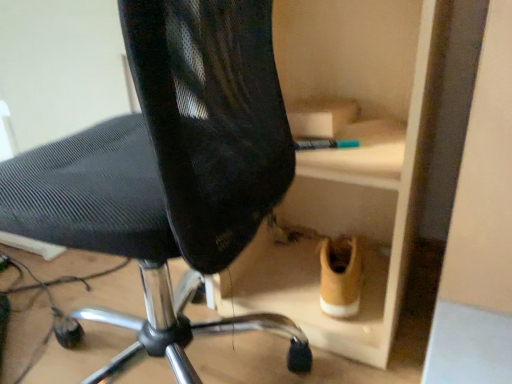
In order to face black mesh chair at center, should I rotate leftwards or rightwards?

You should look left and rotate roughly 17.516 degrees.

This screenshot has height=384, width=512. In order to click on black mesh chair at center in this screenshot , I will do `click(170, 169)`.

This screenshot has width=512, height=384. What do you see at coordinates (170, 169) in the screenshot?
I see `black mesh chair at center` at bounding box center [170, 169].

Looking at this image, measure the distance between black mesh chair at center and camera.

The distance of black mesh chair at center from camera is 14.57 inches.

The image size is (512, 384). I want to click on tan suede sneaker at lower right, so click(x=340, y=277).

Describe the element at coordinates (340, 277) in the screenshot. This screenshot has height=384, width=512. I see `tan suede sneaker at lower right` at that location.

You are a GUI agent. You are given a task and a screenshot of the screen. Output one action in this format:
    pyautogui.click(x=<x>, y=<y>)
    Task: Click on the black mesh chair at center
    Image resolution: width=512 pixels, height=384 pixels.
    Given the screenshot: What is the action you would take?
    pyautogui.click(x=170, y=169)

Based on their positions, is tan suede sneaker at lower right located to the left or right of black mesh chair at center?

In the image, tan suede sneaker at lower right appears on the right side of black mesh chair at center.

Between tan suede sneaker at lower right and black mesh chair at center, which one is positioned behind?

tan suede sneaker at lower right is further away from the camera.

Which is farther from the camera, (x=339, y=313) or (x=49, y=200)?

The point (x=339, y=313) is more distant.

From the image's perspective, is tan suede sneaker at lower right positioned above or below black mesh chair at center?

Based on their image positions, tan suede sneaker at lower right is located beneath black mesh chair at center.

From a real-world perspective, is tan suede sneaker at lower right positioned above or below black mesh chair at center?

tan suede sneaker at lower right is situated lower than black mesh chair at center in the real world.

Between tan suede sneaker at lower right and black mesh chair at center, which one has larger width?

black mesh chair at center is wider.

Considering the sizes of objects tan suede sneaker at lower right and black mesh chair at center in the image provided, who is taller, tan suede sneaker at lower right or black mesh chair at center?

Standing taller between the two is black mesh chair at center.

Between tan suede sneaker at lower right and black mesh chair at center, which one has smaller size?

With smaller size is tan suede sneaker at lower right.

Is tan suede sneaker at lower right situated inside black mesh chair at center or outside?

tan suede sneaker at lower right lies outside black mesh chair at center.

Is tan suede sneaker at lower right placed right next to black mesh chair at center?

No, tan suede sneaker at lower right is not beside black mesh chair at center.

Is tan suede sneaker at lower right facing away from black mesh chair at center?

tan suede sneaker at lower right is not turned away from black mesh chair at center.

Based on the photo, how many degrees apart are the facing directions of tan suede sneaker at lower right and black mesh chair at center?

100 degrees.

How far apart are tan suede sneaker at lower right and black mesh chair at center?

18.43 inches.

Locate an element on the screen. The height and width of the screenshot is (384, 512). footwear located below the black mesh chair at center (from the image's perspective) is located at coordinates (340, 277).

Considering the positions of objects black mesh chair at center and tan suede sneaker at lower right in the image provided, who is more to the right, black mesh chair at center or tan suede sneaker at lower right?

tan suede sneaker at lower right is more to the right.

Is black mesh chair at center in front of or behind tan suede sneaker at lower right in the image?

In the image, black mesh chair at center appears in front of tan suede sneaker at lower right.

Is point (248, 88) more distant than point (355, 284)?

No.

From the image's perspective, is black mesh chair at center located above or below tan suede sneaker at lower right?

Based on their image positions, black mesh chair at center is located above tan suede sneaker at lower right.

From a real-world perspective, who is located higher, black mesh chair at center or tan suede sneaker at lower right?

From a 3D spatial view, black mesh chair at center is above.

Looking at this image, does black mesh chair at center have a greater width compared to tan suede sneaker at lower right?

Yes.

Who is taller, black mesh chair at center or tan suede sneaker at lower right?

With more height is black mesh chair at center.

Looking at this image, considering the relative sizes of black mesh chair at center and tan suede sneaker at lower right in the image provided, is black mesh chair at center smaller than tan suede sneaker at lower right?

No.

Is tan suede sneaker at lower right inside black mesh chair at center?

No, tan suede sneaker at lower right is located outside of black mesh chair at center.

Are black mesh chair at center and tan suede sneaker at lower right making contact?

No.

Is black mesh chair at center looking in the opposite direction of tan suede sneaker at lower right?

No.

Can you tell me how much black mesh chair at center and tan suede sneaker at lower right differ in facing direction?

They differ by 100 degrees in their facing directions.

Where is `footwear on the right of black mesh chair at center`? footwear on the right of black mesh chair at center is located at coordinates [x=340, y=277].

This screenshot has width=512, height=384. In order to click on footwear below the black mesh chair at center (from a real-world perspective) in this screenshot , I will do `click(340, 277)`.

The height and width of the screenshot is (384, 512). Find the location of `chair above the tan suede sneaker at lower right (from a real-world perspective)`. chair above the tan suede sneaker at lower right (from a real-world perspective) is located at coordinates (170, 169).